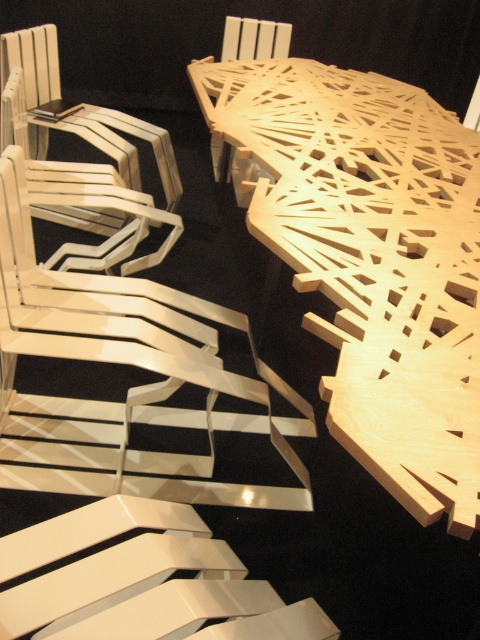
Based on the photo, is white wood chair at left smaller than matte white chair at upper left?

Yes.

Is white wood chair at left bigger than matte white chair at upper left?

No.

This screenshot has width=480, height=640. In order to click on white wood chair at left in this screenshot , I will do `click(131, 387)`.

You are a GUI agent. You are given a task and a screenshot of the screen. Output one action in this format:
    pyautogui.click(x=<x>, y=<y>)
    Task: Click on the white wood chair at left
    
    Given the screenshot: What is the action you would take?
    pyautogui.click(x=131, y=387)

Does point (197, 68) come closer to viewer compared to point (252, 38)?

Yes, point (197, 68) is closer to viewer.

Does natural wood table at center have a lesser width compared to wooden chair at upper center?

Incorrect, natural wood table at center's width is not less than wooden chair at upper center's.

What do you see at coordinates (372, 259) in the screenshot? I see `natural wood table at center` at bounding box center [372, 259].

Find the location of a particular element. The width and height of the screenshot is (480, 640). natural wood table at center is located at coordinates (372, 259).

Does point (349, 179) come closer to viewer compared to point (37, 417)?

No.

Does point (218, 115) come behind point (208, 394)?

That is True.

Where is `natural wood table at center`? natural wood table at center is located at coordinates (372, 259).